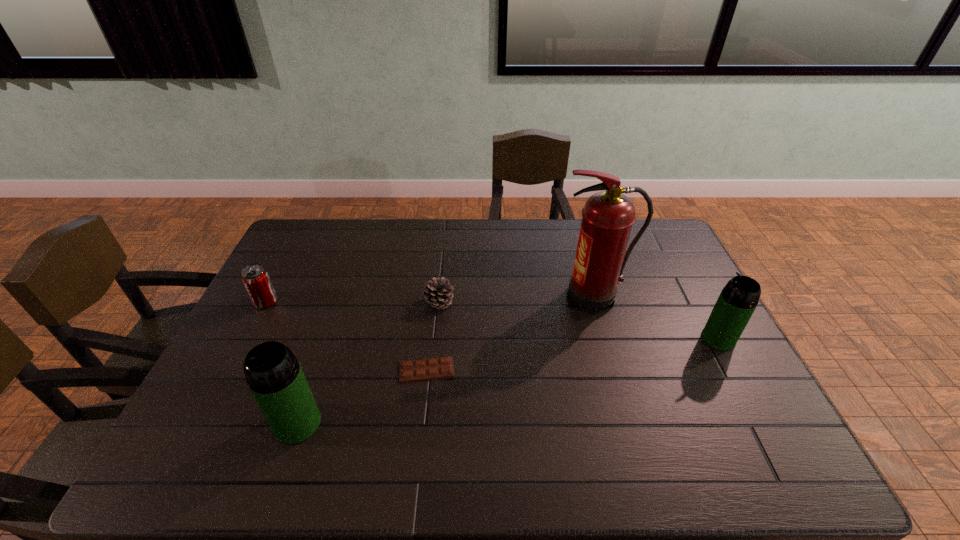
The height and width of the screenshot is (540, 960). What are the coordinates of `the leftmost object` in the screenshot? It's located at (255, 278).

In order to click on free region located from the spout of the third nearest object in this screenshot , I will do `click(595, 339)`.

Where is `free space located 0.350m from the spout of the third nearest object`? The height and width of the screenshot is (540, 960). free space located 0.350m from the spout of the third nearest object is located at coordinates (581, 339).

Where is `free space located from the spout of the third nearest object`? free space located from the spout of the third nearest object is located at coordinates (626, 339).

Locate an element on the screen. Image resolution: width=960 pixels, height=540 pixels. vacant space located on the left of the pinecone is located at coordinates (x=309, y=303).

What are the coordinates of `vacant space located 0.290m on the front-facing side of the fifth object from left to right` in the screenshot? It's located at (464, 298).

Find the location of `free space located on the front-facing side of the fifth object from left to right`. free space located on the front-facing side of the fifth object from left to right is located at coordinates (495, 298).

Locate an element on the screen. Image resolution: width=960 pixels, height=540 pixels. free location located 0.100m on the front-facing side of the fifth object from left to right is located at coordinates (523, 298).

Image resolution: width=960 pixels, height=540 pixels. I want to click on free location located 0.290m on the back of the shortest object, so click(x=436, y=287).

The image size is (960, 540). Identify the location of blank area located on the right of the third shortest object. (297, 302).